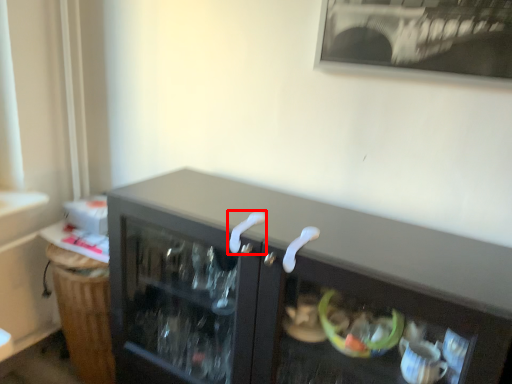
Question: From the image, what is the correct spatial relationship of door handle (annotated by the red box) in relation to door handle?

Choices:
 (A) right
 (B) left

Answer: (B)